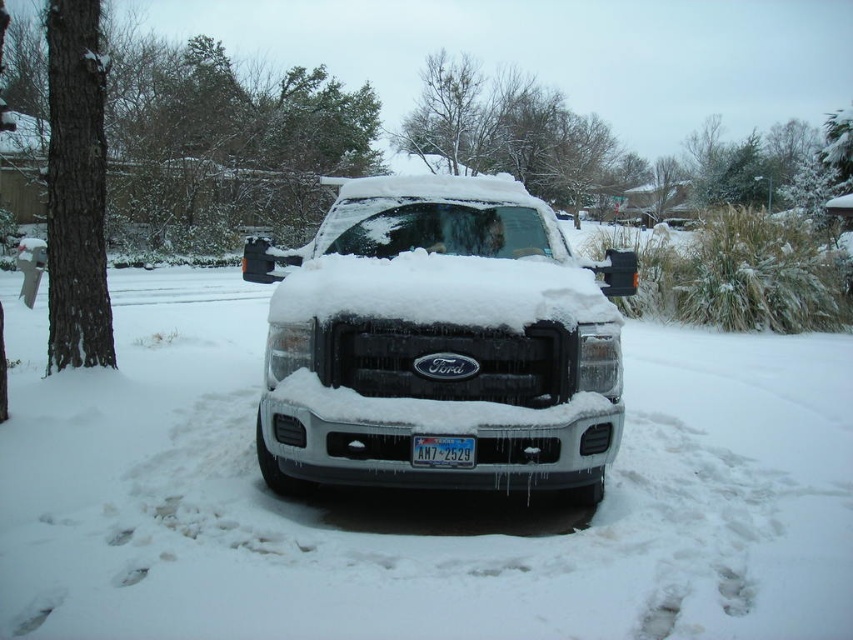
Question: Among these points, which one is nearest to the camera?

Choices:
 (A) (468, 467)
 (B) (438, 474)

Answer: (A)

Question: Can you confirm if white matte truck at center is wider than white plastic license plate at center?

Choices:
 (A) no
 (B) yes

Answer: (B)

Question: Which point is closer to the camera?

Choices:
 (A) white plastic license plate at center
 (B) white matte truck at center

Answer: (A)

Question: Can you confirm if white matte truck at center is positioned above white plastic license plate at center?

Choices:
 (A) no
 (B) yes

Answer: (B)

Question: Is white matte truck at center smaller than white plastic license plate at center?

Choices:
 (A) yes
 (B) no

Answer: (B)